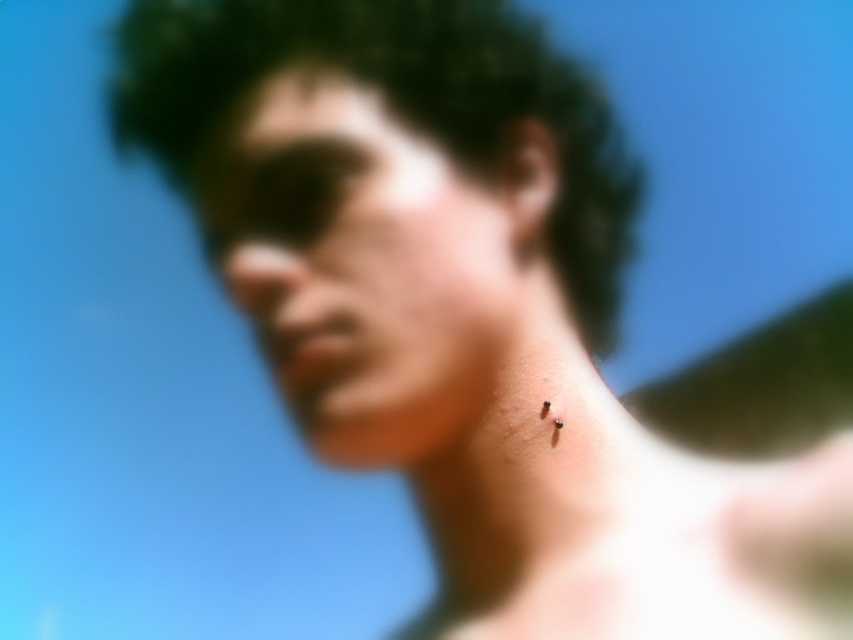
Question: Is smooth skin face at center positioned before dark curly hair at center?

Choices:
 (A) yes
 (B) no

Answer: (A)

Question: Which of the following is the closest to the observer?

Choices:
 (A) (471, 218)
 (B) (223, 88)

Answer: (A)

Question: Among these points, which one is nearest to the camera?

Choices:
 (A) (386, 19)
 (B) (300, 161)

Answer: (B)

Question: Which point is closer to the camera taking this photo?

Choices:
 (A) (321, 40)
 (B) (323, 452)

Answer: (B)

Question: Does smooth skin face at center appear on the left side of dark curly hair at center?

Choices:
 (A) yes
 (B) no

Answer: (A)

Question: Is smooth skin face at center smaller than dark curly hair at center?

Choices:
 (A) no
 (B) yes

Answer: (B)